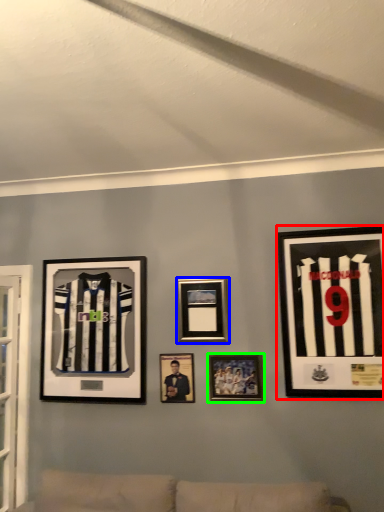
Question: Based on their relative distances, which object is nearer to picture frame (highlighted by a red box)? Choose from picture frame (highlighted by a blue box) and picture frame (highlighted by a green box).

Choices:
 (A) picture frame
 (B) picture frame

Answer: (B)